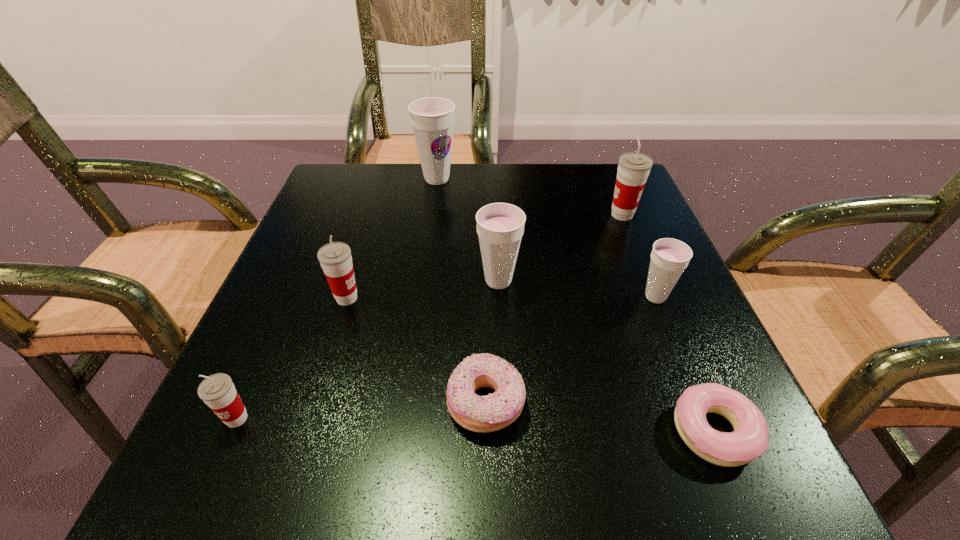
Where is `free spot located on the front of the third cup from right to left`? The image size is (960, 540). free spot located on the front of the third cup from right to left is located at coordinates (508, 488).

Image resolution: width=960 pixels, height=540 pixels. I want to click on free location located on the back of the smallest purple cup, so click(x=640, y=260).

Find the location of a particular element. Image resolution: width=960 pixels, height=540 pixels. free region located 0.060m on the side of the leftmost object with the logo is located at coordinates (211, 477).

The height and width of the screenshot is (540, 960). I want to click on free location located on the back of the taller doughnut, so click(485, 330).

The image size is (960, 540). What are the coordinates of `free space located 0.060m on the left of the pink doughnut` in the screenshot? It's located at (628, 431).

This screenshot has height=540, width=960. I want to click on cup located at the near edge, so click(x=217, y=391).

Identify the location of doughnut situated at the right edge. This screenshot has height=540, width=960. (750, 438).

Image resolution: width=960 pixels, height=540 pixels. Find the location of `object positioned at the near left corner`. object positioned at the near left corner is located at coordinates (217, 391).

This screenshot has height=540, width=960. I want to click on object that is at the far right corner, so click(x=633, y=169).

Identify the location of object located in the near right corner section of the desktop. This screenshot has height=540, width=960. (750, 438).